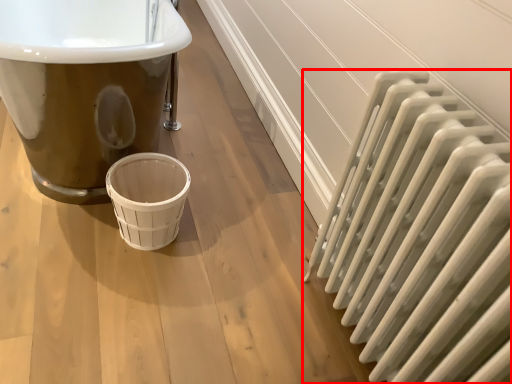
Question: From the image's perspective, what is the correct spatial relationship of radiator (annotated by the red box) in relation to basket?

Choices:
 (A) above
 (B) below

Answer: (B)